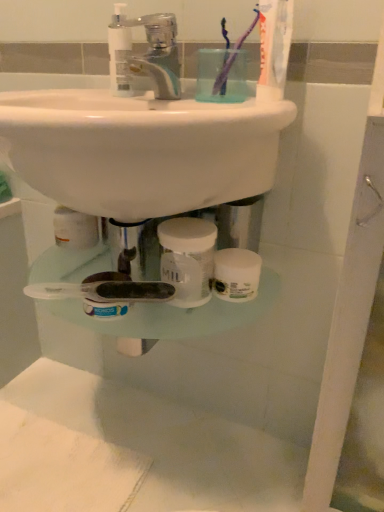
This screenshot has height=512, width=384. In order to click on vacant area in front of purple translucent toothbrush at upper center, the 1th toothbrush when ordered from right to left in this screenshot , I will do `click(231, 108)`.